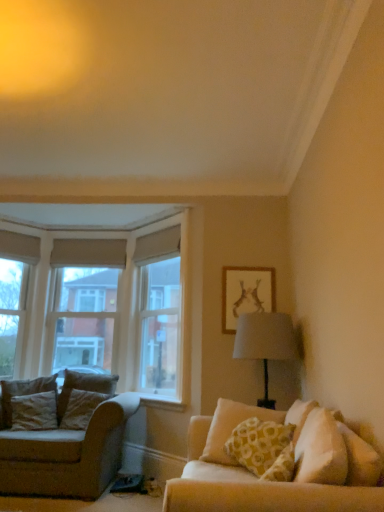
Question: Is velvet beige pillow at left, positioned as the 2th pillow in right-to-left order, at the right side of beige fabric couch at left?

Choices:
 (A) no
 (B) yes

Answer: (B)

Question: Is velvet beige pillow at left, the second pillow positioned from the left, aimed at beige fabric couch at left?

Choices:
 (A) yes
 (B) no

Answer: (A)

Question: Considering the relative sizes of velvet beige pillow at left, positioned as the 2th pillow in right-to-left order, and beige fabric couch at left in the image provided, is velvet beige pillow at left, positioned as the 2th pillow in right-to-left order, taller than beige fabric couch at left?

Choices:
 (A) no
 (B) yes

Answer: (A)

Question: From the image's perspective, is velvet beige pillow at left, positioned as the 2th pillow in right-to-left order, under beige fabric couch at left?

Choices:
 (A) yes
 (B) no

Answer: (B)

Question: From a real-world perspective, is velvet beige pillow at left, the 1th pillow positioned from the back, below beige fabric couch at left?

Choices:
 (A) no
 (B) yes

Answer: (A)

Question: In the image, is yellow printed cushion at right, the third pillow positioned from the back, on the left side or the right side of clear glass window at upper center?

Choices:
 (A) right
 (B) left

Answer: (A)

Question: Would you say yellow printed cushion at right, the 1th pillow when ordered from front to back, is inside or outside clear glass window at upper center?

Choices:
 (A) outside
 (B) inside

Answer: (A)

Question: Is yellow printed cushion at right, the third pillow positioned from the back, in front of or behind clear glass window at upper center in the image?

Choices:
 (A) front
 (B) behind

Answer: (A)

Question: From the image's perspective, is yellow printed cushion at right, the 1th pillow when ordered from front to back, positioned above or below clear glass window at upper center?

Choices:
 (A) below
 (B) above

Answer: (A)

Question: Is velvet brown pillow at left, which is counted as the 1th pillow, starting from the left, in front of or behind white painted wood at lower center in the image?

Choices:
 (A) front
 (B) behind

Answer: (A)

Question: In terms of height, does velvet brown pillow at left, positioned as the 2th pillow in front-to-back order, look taller or shorter compared to white painted wood at lower center?

Choices:
 (A) tall
 (B) short

Answer: (A)

Question: Based on their positions, is velvet brown pillow at left, which is counted as the 1th pillow, starting from the left, located to the left or right of white painted wood at lower center?

Choices:
 (A) left
 (B) right

Answer: (A)

Question: Is point (31, 430) closer or farther from the camera than point (183, 403)?

Choices:
 (A) closer
 (B) farther

Answer: (A)

Question: In terms of height, does velvet beige pillow at left, positioned as the 2th pillow in right-to-left order, look taller or shorter compared to beige fabric couch at left?

Choices:
 (A) short
 (B) tall

Answer: (A)

Question: Is velvet beige pillow at left, positioned as the 2th pillow in right-to-left order, inside or outside of beige fabric couch at left?

Choices:
 (A) inside
 (B) outside

Answer: (A)